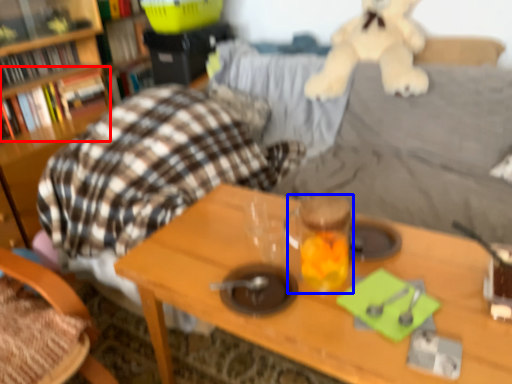
Question: Which object appears farthest to the camera in this image, book (highlighted by a red box) or beverage (highlighted by a blue box)?

Choices:
 (A) book
 (B) beverage

Answer: (A)